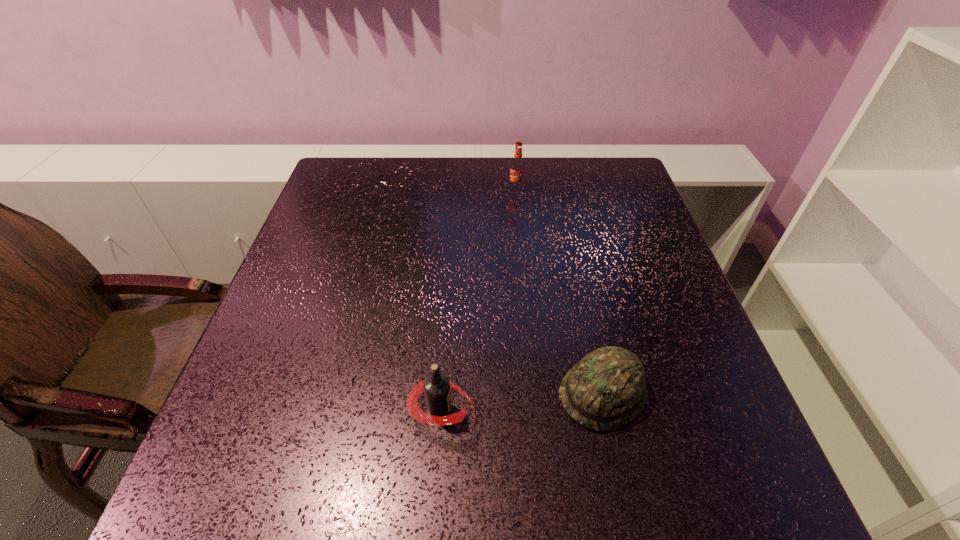
At what (x,y) coordinates should I click in order to perform the action: click on vacant region that satisfies the following two spatial constraints: 1. on the front side of the second object from right to left; 2. on the right side of the headwear. Please return your answer as a coordinate pair (x, y). The image size is (960, 540). Looking at the image, I should click on tap(537, 393).

The width and height of the screenshot is (960, 540). I want to click on free spot that satisfies the following two spatial constraints: 1. on the front side of the headwear; 2. on the label of the nearer root beer, so click(x=607, y=410).